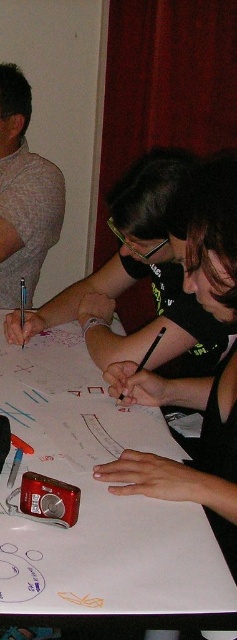
Does white paper at center have a lesser height compared to gray matte shirt at left?

Correct, white paper at center is not as tall as gray matte shirt at left.

Is point (186, 454) positioned in front of point (7, 220)?

Yes, point (186, 454) is in front of point (7, 220).

Identify the location of white paper at center. The width and height of the screenshot is (237, 640). (96, 500).